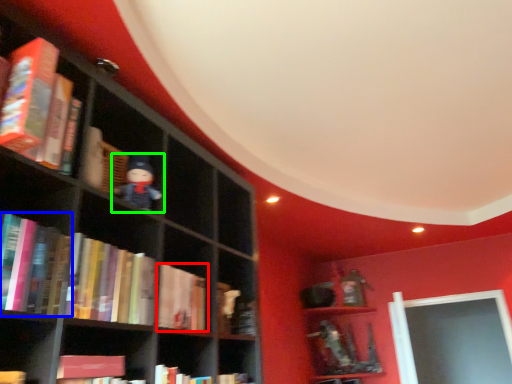
Question: Which is nearer to the book (highlighted by a red box)? book (highlighted by a blue box) or toy (highlighted by a green box).

Choices:
 (A) book
 (B) toy

Answer: (B)